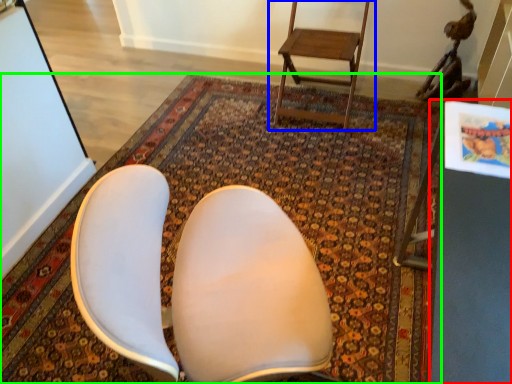
Question: Based on their relative distances, which object is farther from table (highlighted by a red box)? Choose from chair (highlighted by a blue box) and mat (highlighted by a green box).

Choices:
 (A) chair
 (B) mat

Answer: (A)